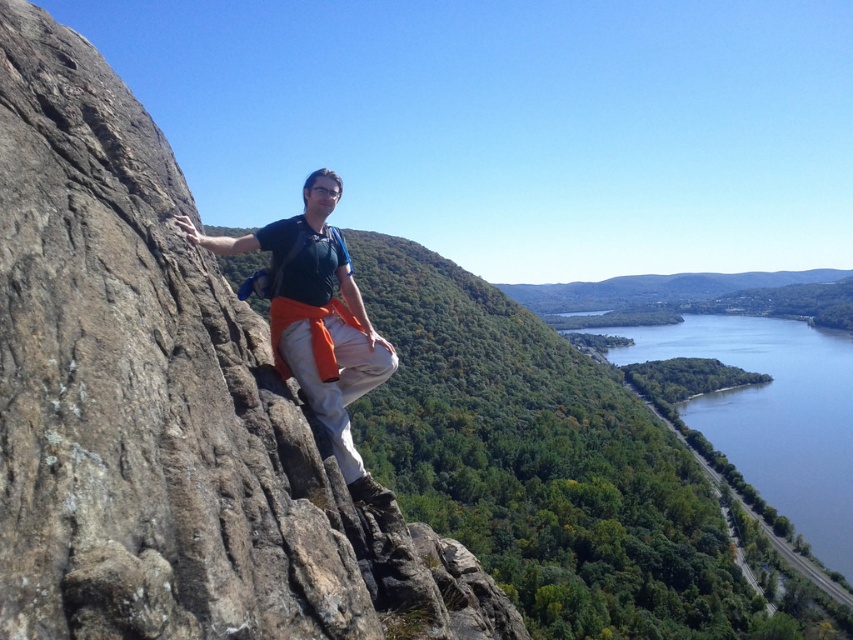
Between point (778, 492) and point (305, 371), which one is positioned in front?

Point (305, 371) is in front.

Where is `blue glassy water at lower right`? The height and width of the screenshot is (640, 853). blue glassy water at lower right is located at coordinates (772, 413).